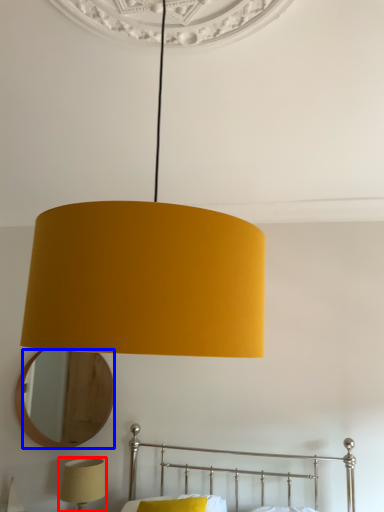
Question: Among these objects, which one is farthest to the camera, lamp (highlighted by a red box) or mirror (highlighted by a blue box)?

Choices:
 (A) lamp
 (B) mirror

Answer: (B)